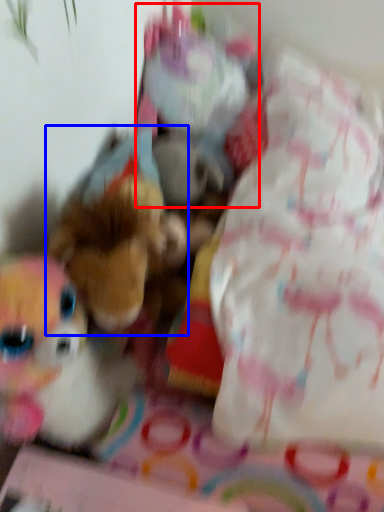
Question: Which point is closer to the camera, toy (highlighted by a red box) or toy (highlighted by a blue box)?

Choices:
 (A) toy
 (B) toy

Answer: (B)